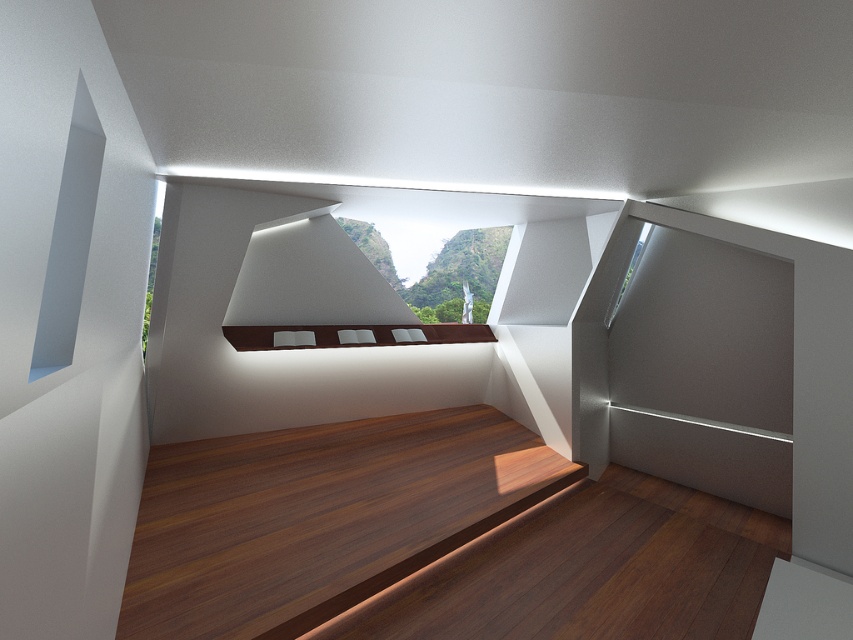
In the scene shown: Measure the distance from brown matte bench at center to clear glass window at upper right.

A distance of 2.07 meters exists between brown matte bench at center and clear glass window at upper right.

Describe the element at coordinates (352, 328) in the screenshot. The image size is (853, 640). I see `brown matte bench at center` at that location.

Where is `brown matte bench at center`? This screenshot has width=853, height=640. brown matte bench at center is located at coordinates (352, 328).